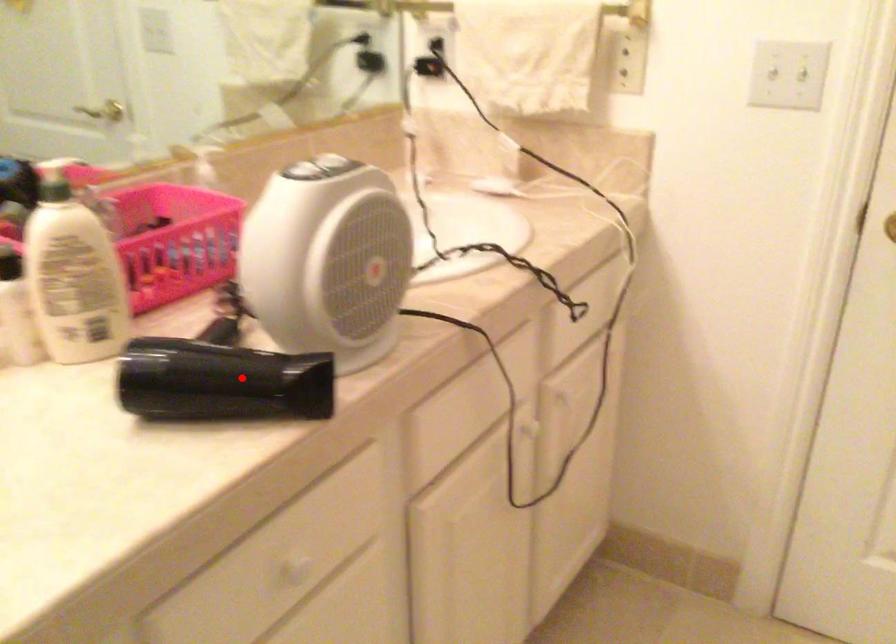
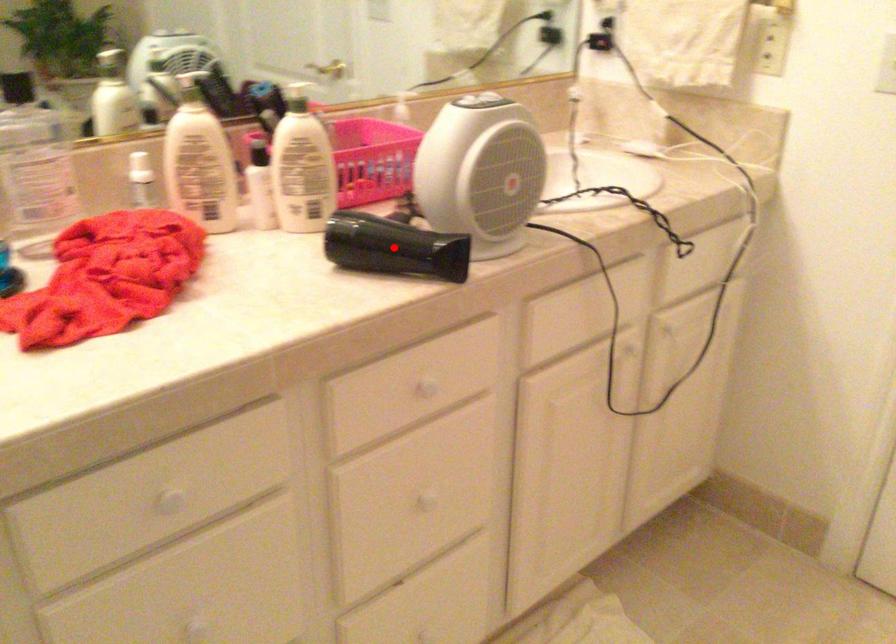
I am providing you with two images of the same scene from different viewpoints. A red point is marked on the first image and another point is marked on the second image. Does the point marked in image1 correspond to the same location as the one in image2?

Yes